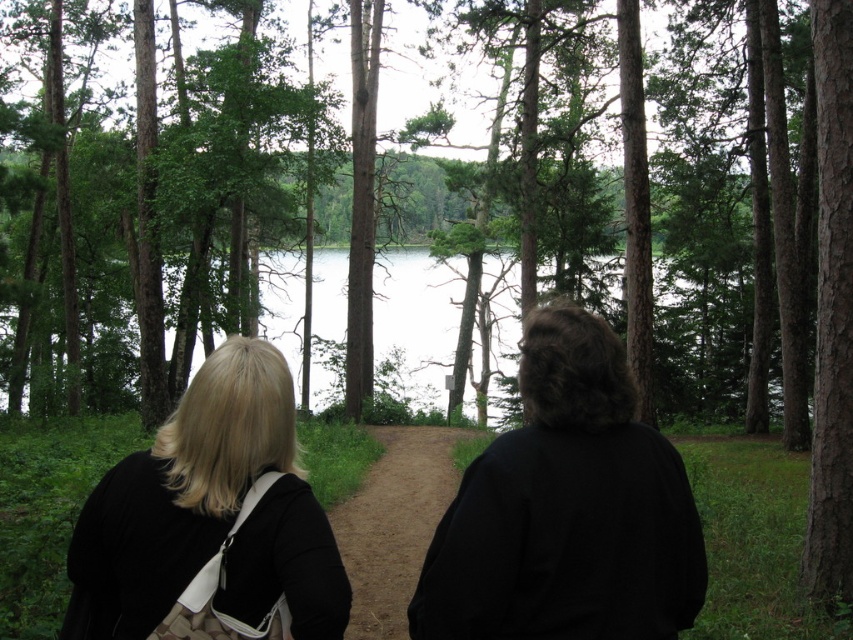
Does blonde hair at center lie in front of dirt path at center?

Yes, it is in front of dirt path at center.

Does blonde hair at center appear on the right side of dirt path at center?

Incorrect, blonde hair at center is not on the right side of dirt path at center.

Which is in front, point (76, 612) or point (380, 580)?

Point (76, 612) is more forward.

At what (x,y) coordinates should I click in order to perform the action: click on blonde hair at center. Please return your answer as a coordinate pair (x, y). Image resolution: width=853 pixels, height=640 pixels. Looking at the image, I should click on (209, 513).

Is point (169, 163) positioned behind point (706, 416)?

No, it is not.

Is point (61, 316) farther from camera compared to point (665, 368)?

Yes.

Locate an element on the screen. Image resolution: width=853 pixels, height=640 pixels. brown textured tree at center is located at coordinates (171, 218).

Is point (105, 145) farther from camera compared to point (589, 384)?

That is True.

Is point (144, 164) in front of point (200, 561)?

No, (144, 164) is further to viewer.

Is point (190, 193) positioned before point (466, 627)?

No.

Image resolution: width=853 pixels, height=640 pixels. I want to click on brown textured tree at center, so click(171, 218).